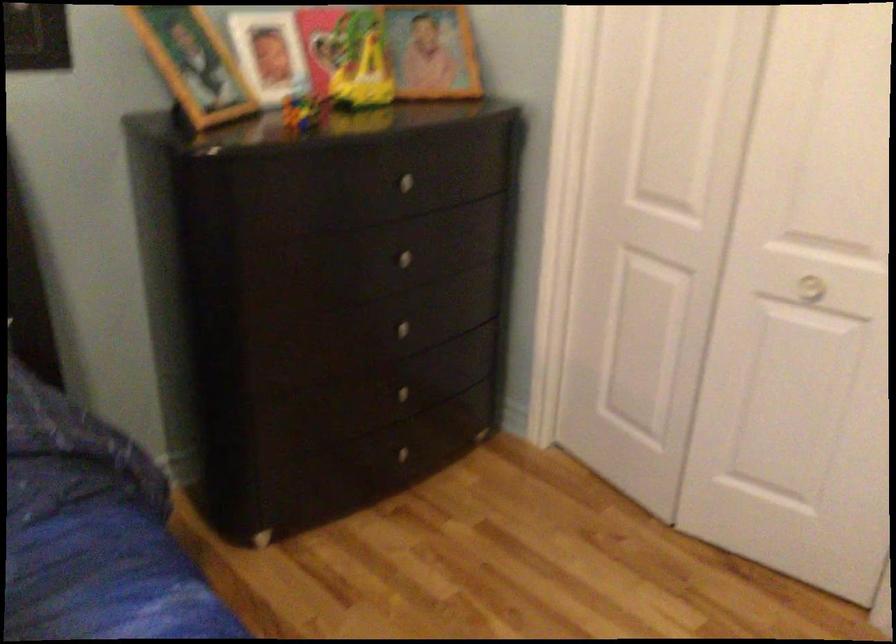
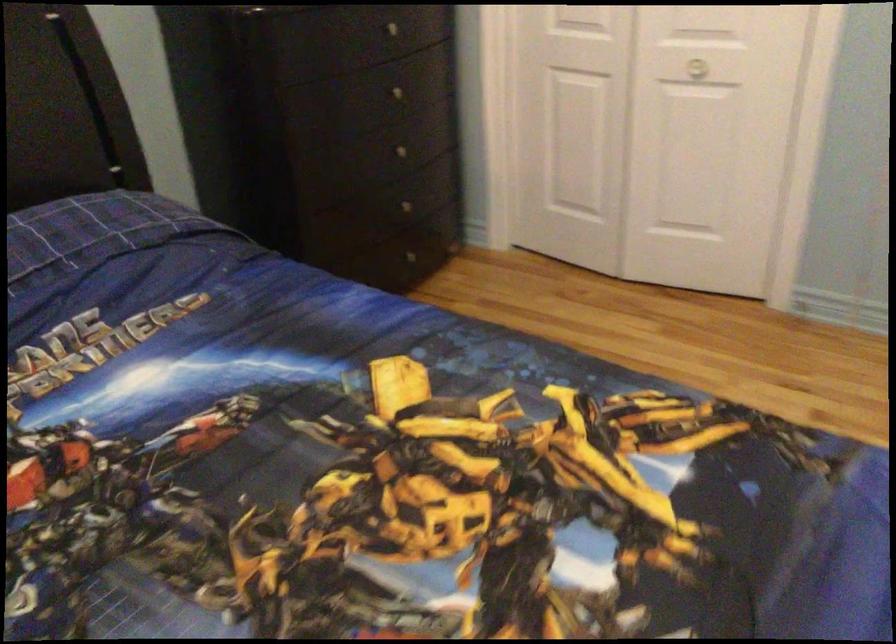
In a continuous first-person perspective shot, in which direction is the camera moving?

The movement direction of the cameraman is left, backward.